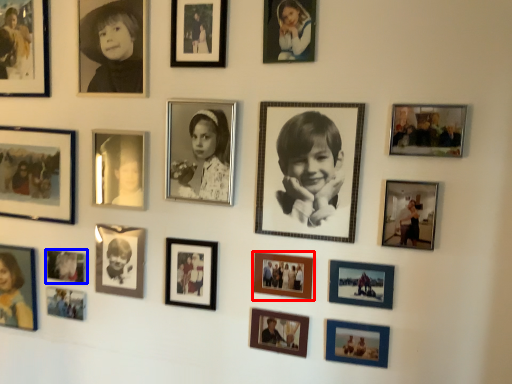
Question: Among these objects, which one is farthest to the camera, picture frame (highlighted by a red box) or picture frame (highlighted by a blue box)?

Choices:
 (A) picture frame
 (B) picture frame

Answer: (B)